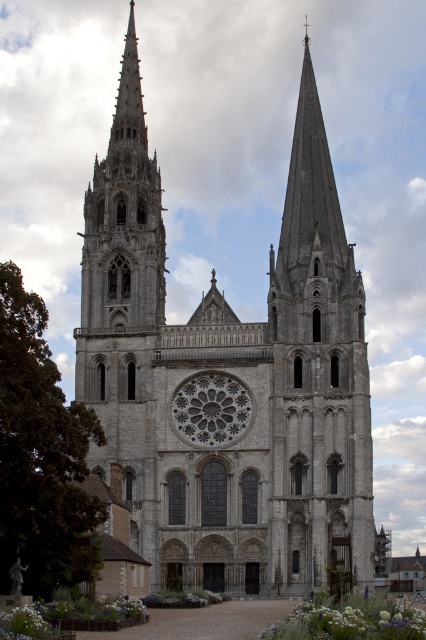
You are standing in front of Chartres Cathedral and want to take a photo of the gray stone church at center. Where should you position yourself to capture the entire structure in your camera frame?

To capture the entire gray stone church at center in your camera frame, position yourself at point (232, 374).

You are an architect planning to create a scale model of the Chartres Cathedral. You have a space constraint that requires the model to be no wider than 30 cm. If the gray stone rose window at center is 10 cm wide in the model, will the gray stone church at center fit within the 30 cm width limit?

The gray stone church at center is wider than the gray stone rose window at center. Since the rose window is 10 cm in the model, the church would be wider than 10 cm. However, without knowing the exact proportion between their widths, it is impossible to determine if the total width of the church will exceed 30 cm. More information about their size relationship is needed.